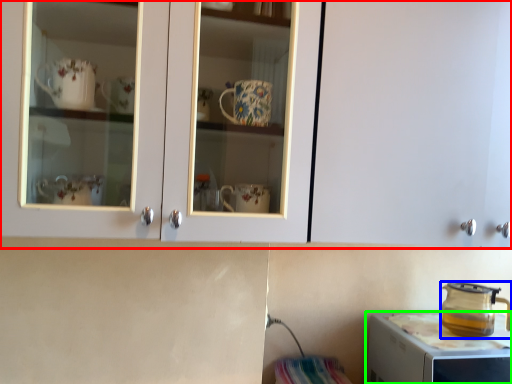
Question: Based on their relative distances, which object is farther from cabinetry (highlighted by a red box)? Choose from kitchen appliance (highlighted by a blue box) and home appliance (highlighted by a green box).

Choices:
 (A) kitchen appliance
 (B) home appliance

Answer: (A)